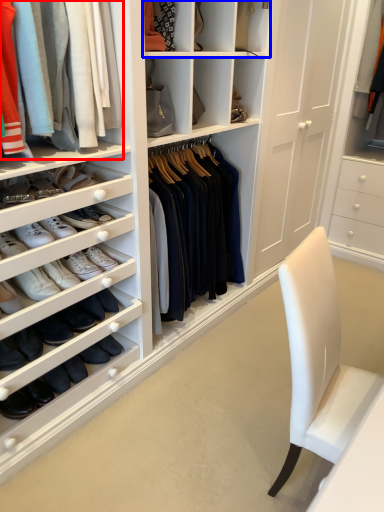
Question: Among these objects, which one is nearest to the camera, clothing (highlighted by a red box) or shelf (highlighted by a blue box)?

Choices:
 (A) clothing
 (B) shelf

Answer: (A)